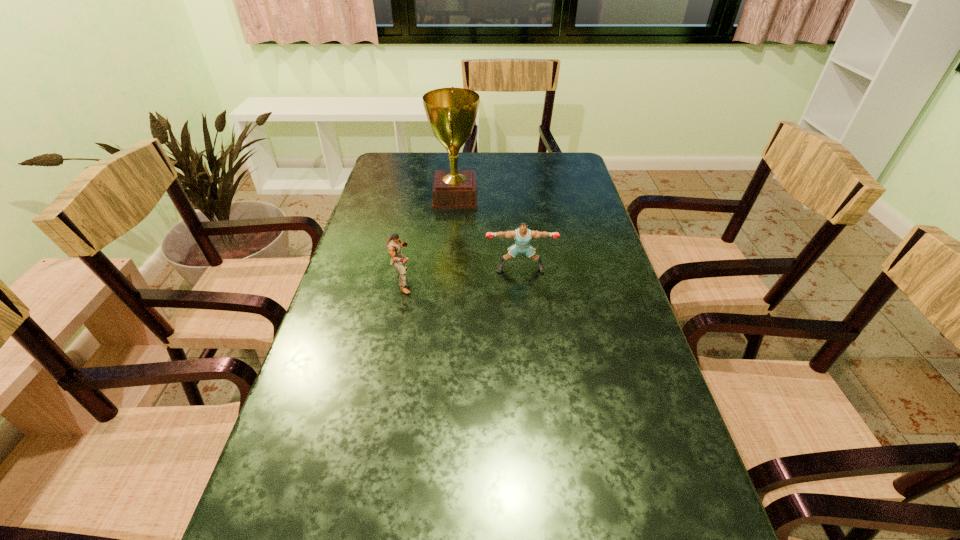
Where is `vacant position in the image that satisfies the following two spatial constraints: 1. on the front-facing side of the rightmost object; 2. on the front-facing side of the left puncher`? vacant position in the image that satisfies the following two spatial constraints: 1. on the front-facing side of the rightmost object; 2. on the front-facing side of the left puncher is located at coordinates (x=521, y=280).

This screenshot has width=960, height=540. In order to click on vacant position in the image that satisfies the following two spatial constraints: 1. on the front-facing side of the rightmost object; 2. on the front-facing side of the leftmost object in this screenshot , I will do `click(521, 280)`.